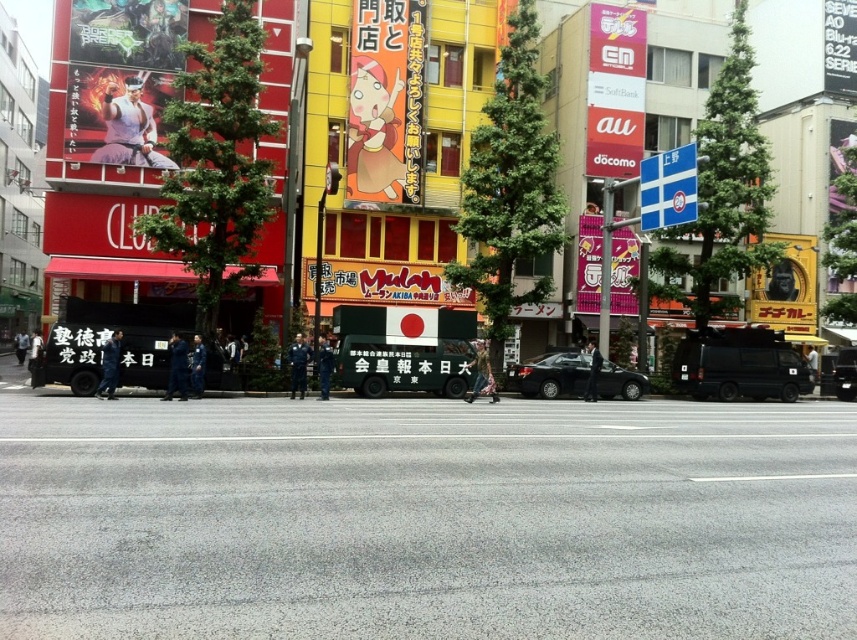
You are a delivery drone operator. Your drone is currently at point A, which is at coordinates [615,90]. You need to deliver a package to the pink matte sign at upper center. Is your drone already at the correct location?

Yes, the pink matte sign at upper center is located at point [615,90], so the drone is already at the correct location.